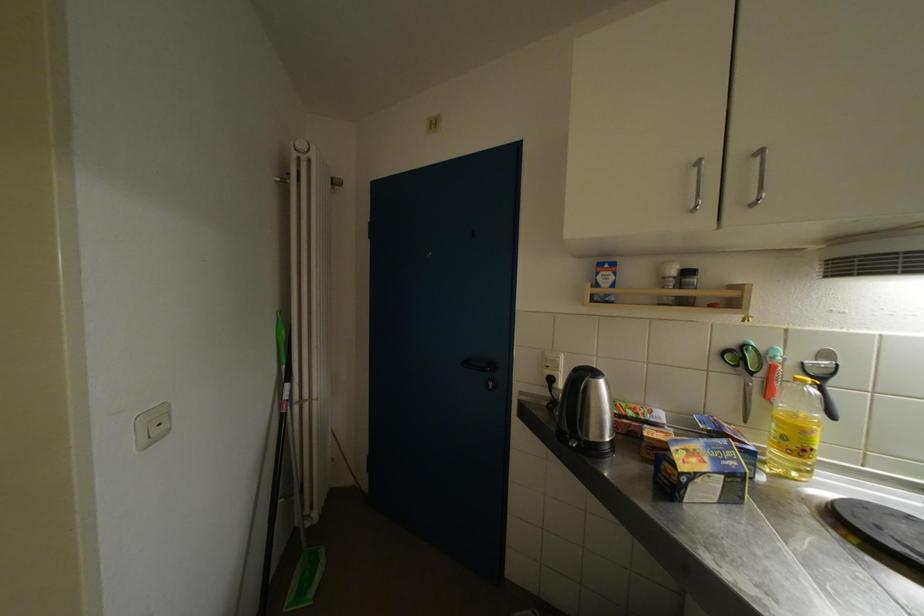
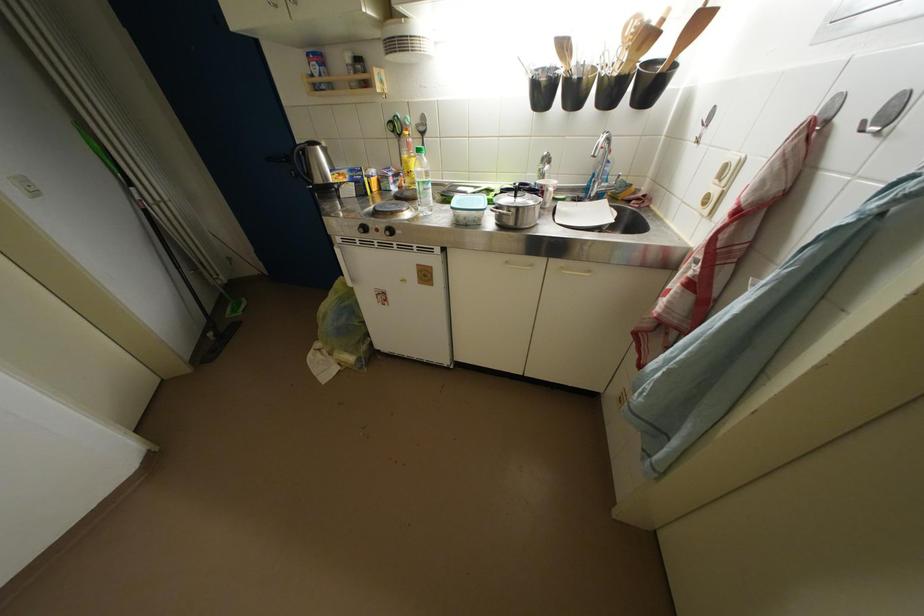
Where in the second image is the point corresponding to (810,436) from the first image?

(412, 167)